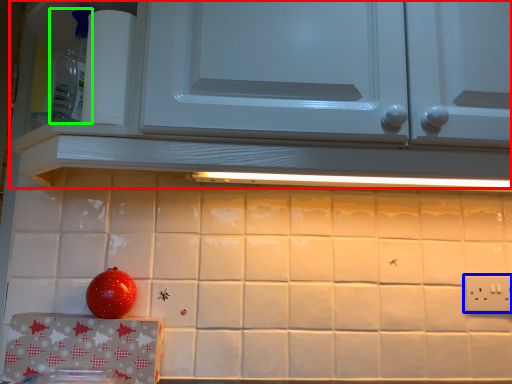
Question: Considering the real-world distances, which object is closest to cabinetry (highlighted by a red box)? electric outlet (highlighted by a blue box) or appliance (highlighted by a green box).

Choices:
 (A) electric outlet
 (B) appliance

Answer: (B)